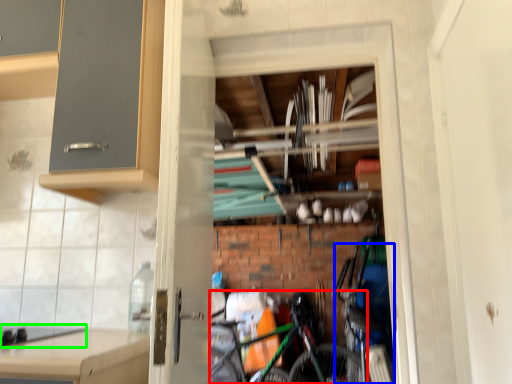
Question: Considering the real-world distances, which object is closest to bicycle (highlighted by a red box)? bicycle (highlighted by a blue box) or gas stove (highlighted by a green box).

Choices:
 (A) bicycle
 (B) gas stove

Answer: (A)